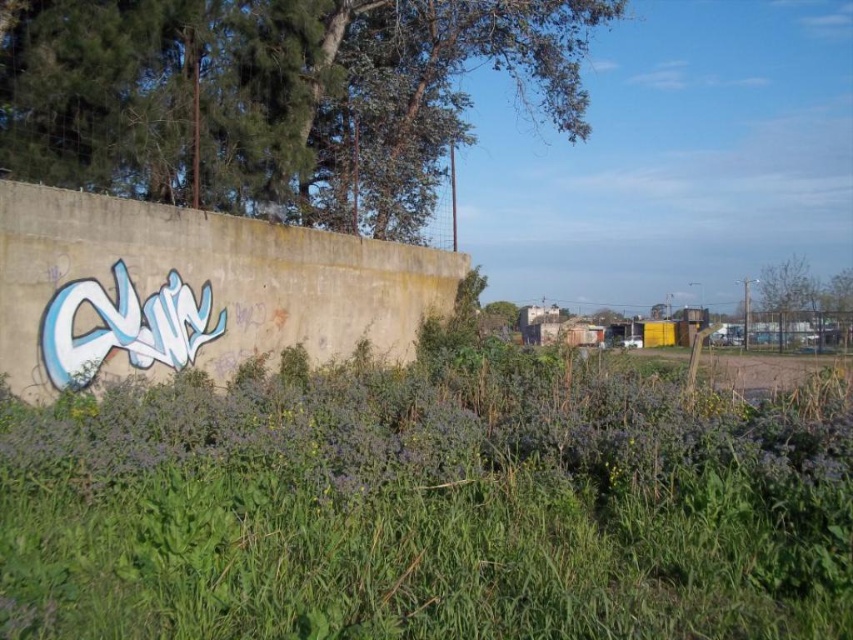
Looking at this image, you are a landscape architect designing a new garden. You need to place a 10 meter wide water feature between the green leafy grass at center and the green leafy tree at upper right. Is there enough space for it?

The distance between the green leafy grass at center and the green leafy tree at upper right is 57.32 meters. Since the water feature is only 10 meters wide, there is ample space to place it between them.

You are a gardener looking at the image. You need to determine the relative positions of the green leafy grass at center and the green leafy tree at upper left. Which one is located lower in the image?

The green leafy grass at center is located lower in the image than the green leafy tree at upper left.

You are standing in front of the concrete wall with graffiti. You see a point marked at coordinates [428,508]. What is located at that point?

The point at coordinates [428,508] indicates green leafy grass at center.